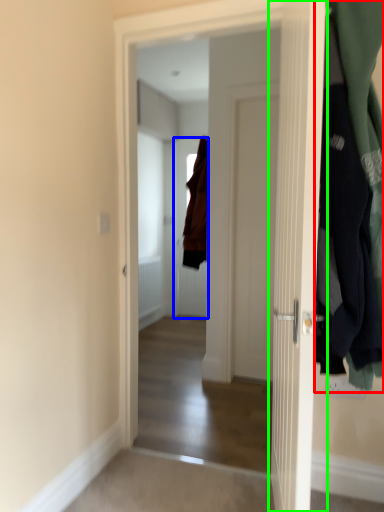
Question: Considering the real-world distances, which object is closest to closet (highlighted by a red box)? door (highlighted by a blue box) or door (highlighted by a green box).

Choices:
 (A) door
 (B) door

Answer: (B)